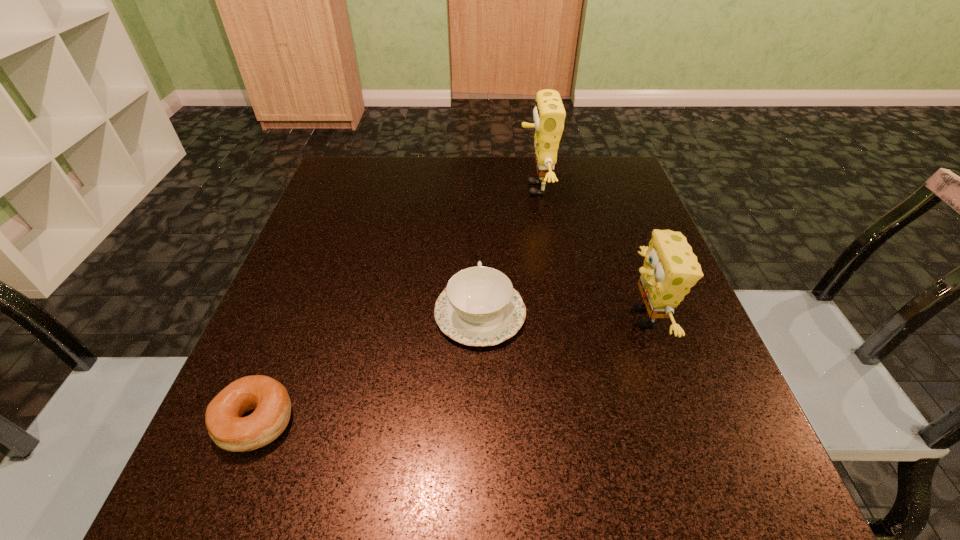
I want to click on the taller sponge, so click(x=549, y=114).

At what (x,y) coordinates should I click in order to perform the action: click on the farthest object. Please return your answer as a coordinate pair (x, y). The image size is (960, 540). Looking at the image, I should click on (549, 114).

Locate an element on the screen. This screenshot has height=540, width=960. the shorter sponge is located at coordinates (670, 269).

Image resolution: width=960 pixels, height=540 pixels. I want to click on the right sponge, so click(x=670, y=269).

This screenshot has width=960, height=540. Find the location of `the third object from right to left`. the third object from right to left is located at coordinates [479, 307].

What are the coordinates of `chinaware` in the screenshot? It's located at (479, 307).

The image size is (960, 540). Find the location of `the shortest object`. the shortest object is located at coordinates (269, 399).

In order to click on bagel in this screenshot , I will do `click(269, 399)`.

Where is `vacant space located on the face of the taller sponge`? vacant space located on the face of the taller sponge is located at coordinates (377, 188).

Identify the location of vacant area located 0.290m on the face of the taller sponge. (401, 188).